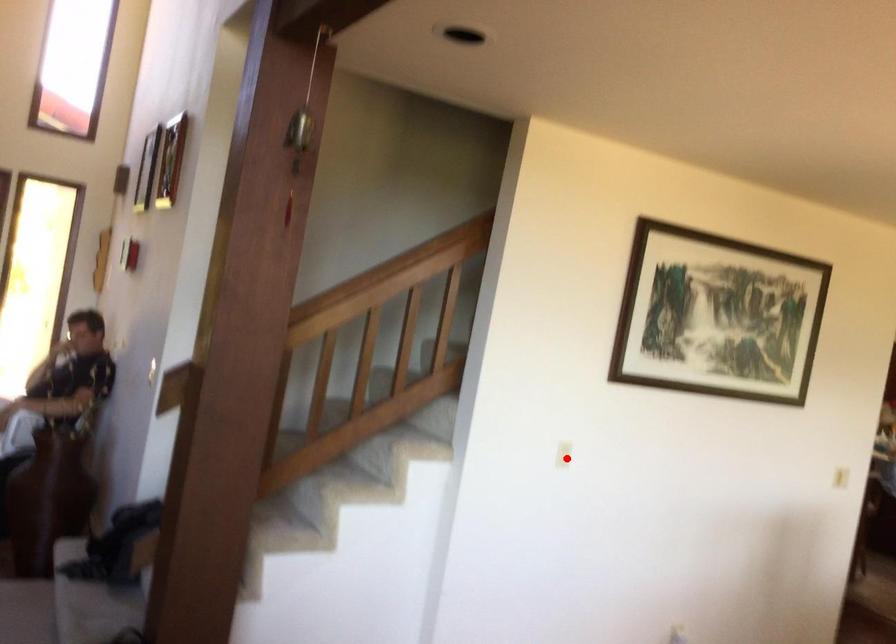
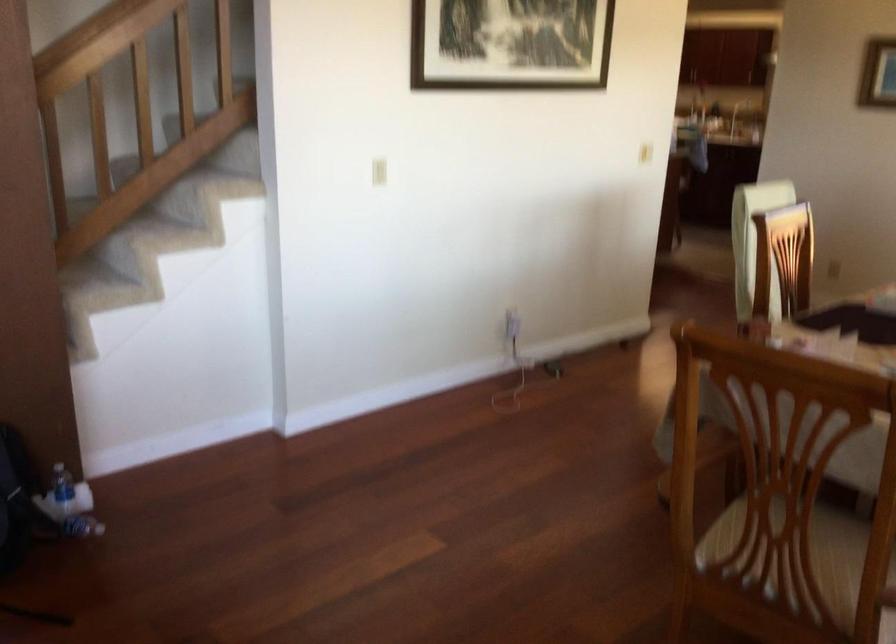
The point at the highlighted location is marked in the first image. Where is the corresponding point in the second image?

(378, 172)